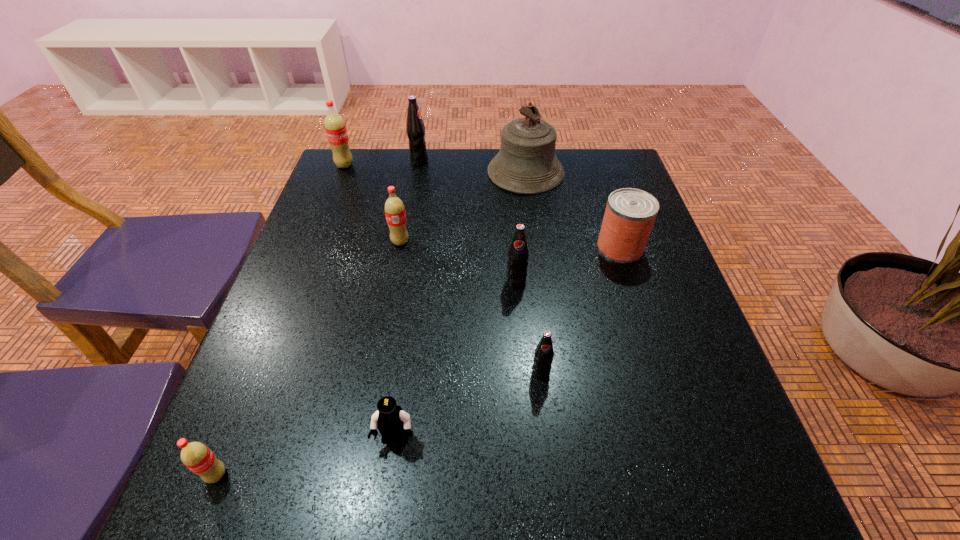
Locate an element on the screen. the closest black pop to the second nearest soda is located at coordinates (518, 254).

Identify the location of red soda object that ranks as the closest to the biggest red soda. (394, 208).

Locate an element on the screen. This screenshot has width=960, height=540. red soda object that ranks as the third closest to the Lego is located at coordinates (335, 127).

What are the coordinates of `vacant position in the image that satisfies the following two spatial constraints: 1. on the front label of the farthest black pop; 2. on the front side of the second farthest red soda` in the screenshot? It's located at (405, 242).